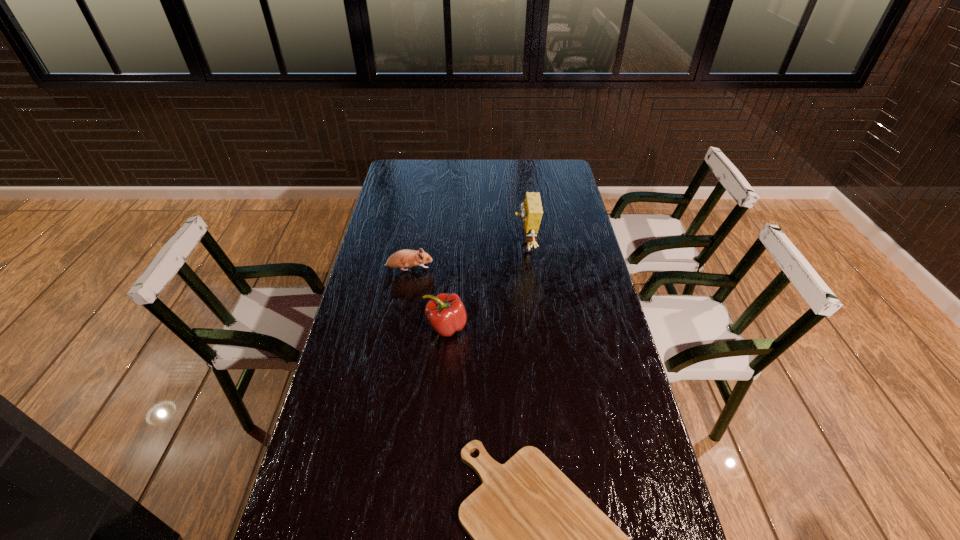
Where is `free spot between the hamster and the pepper`? free spot between the hamster and the pepper is located at coordinates (427, 298).

Point out which object is positioned as the third nearest to the tallest object. Please provide its 2D coordinates. Your answer should be formatted as a tuple, i.e. [(x, y)], where the tuple contains the x and y coordinates of a point satisfying the conditions above.

[(537, 539)]

Identify the location of the third closest object to the nearest object. (401, 259).

You are a GUI agent. You are given a task and a screenshot of the screen. Output one action in this format:
    pyautogui.click(x=<x>, y=<y>)
    Task: Click on the vacant point that satisfies the following two spatial constraints: 1. at the face of the second tallest object; 2. on the right side of the hamster
    This screenshot has width=960, height=540.
    Given the screenshot: What is the action you would take?
    pyautogui.click(x=399, y=327)

At what (x,y) coordinates should I click in order to perform the action: click on vacant region that satisfies the following two spatial constraints: 1. at the face of the second tallest object; 2. on the right side of the hamster. Please return your answer as a coordinate pair (x, y). The image size is (960, 540). Looking at the image, I should click on (399, 327).

I want to click on vacant space that satisfies the following two spatial constraints: 1. at the face of the hamster; 2. on the back side of the second nearest object, so click(399, 327).

Identify the location of free spot that satisfies the following two spatial constraints: 1. on the face of the tallest object; 2. on the front side of the third shortest object. This screenshot has height=540, width=960. (534, 327).